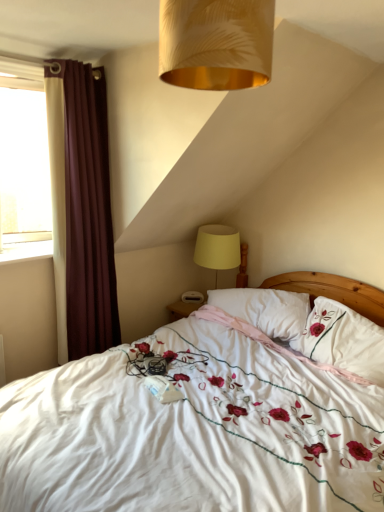
Question: Is gold textured lampshade at upper center positioned with its back to maroon fabric curtain at left?

Choices:
 (A) no
 (B) yes

Answer: (A)

Question: Can you confirm if gold textured lampshade at upper center is smaller than maroon fabric curtain at left?

Choices:
 (A) yes
 (B) no

Answer: (A)

Question: Can you confirm if gold textured lampshade at upper center is wider than maroon fabric curtain at left?

Choices:
 (A) no
 (B) yes

Answer: (A)

Question: Does gold textured lampshade at upper center come behind maroon fabric curtain at left?

Choices:
 (A) yes
 (B) no

Answer: (B)

Question: Is gold textured lampshade at upper center at the left side of maroon fabric curtain at left?

Choices:
 (A) yes
 (B) no

Answer: (B)

Question: Is gold textured lampshade at upper center to the right of maroon fabric curtain at left from the viewer's perspective?

Choices:
 (A) no
 (B) yes

Answer: (B)

Question: Can you confirm if white embroidered fabric at center is wider than white soft pillow at center, acting as the 2th pillow starting from the right?

Choices:
 (A) yes
 (B) no

Answer: (A)

Question: From the image's perspective, is white embroidered fabric at center located beneath white soft pillow at center, arranged as the first pillow when viewed from the left?

Choices:
 (A) yes
 (B) no

Answer: (A)

Question: Can white soft pillow at center, acting as the 2th pillow starting from the right, be found inside white embroidered fabric at center?

Choices:
 (A) yes
 (B) no

Answer: (A)

Question: Is white embroidered fabric at center facing towards white soft pillow at center, acting as the 2th pillow starting from the right?

Choices:
 (A) yes
 (B) no

Answer: (B)

Question: From the image's perspective, is white embroidered fabric at center above white soft pillow at center, acting as the 2th pillow starting from the right?

Choices:
 (A) no
 (B) yes

Answer: (A)

Question: Is white embroidered fabric at center far away from white soft pillow at center, arranged as the first pillow when viewed from the left?

Choices:
 (A) no
 (B) yes

Answer: (A)

Question: From the image's perspective, is yellow fabric lampshade at upper right below white glossy window sill at left?

Choices:
 (A) no
 (B) yes

Answer: (B)